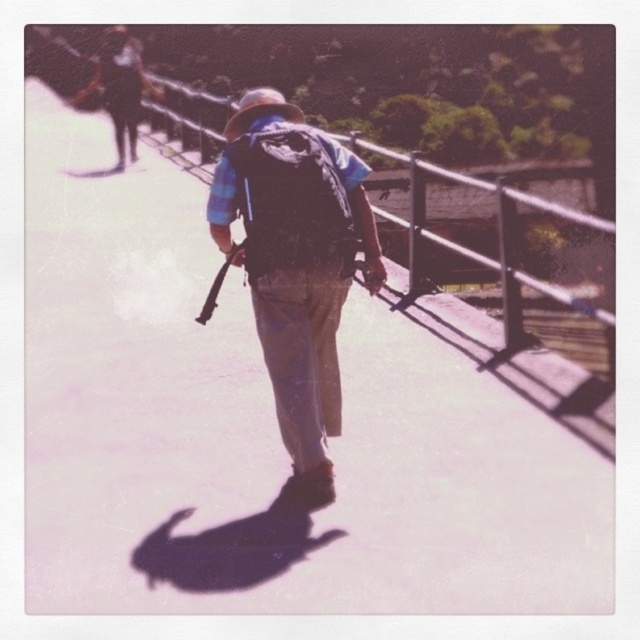
Can you confirm if matte blue backpack at center is bigger than matte black backpack at center?

Yes.

Is point (330, 372) closer to camera compared to point (257, 269)?

No, (330, 372) is further to viewer.

Who is more forward, (320,269) or (316,166)?

Point (316,166) is more forward.

I want to click on matte blue backpack at center, so click(296, 262).